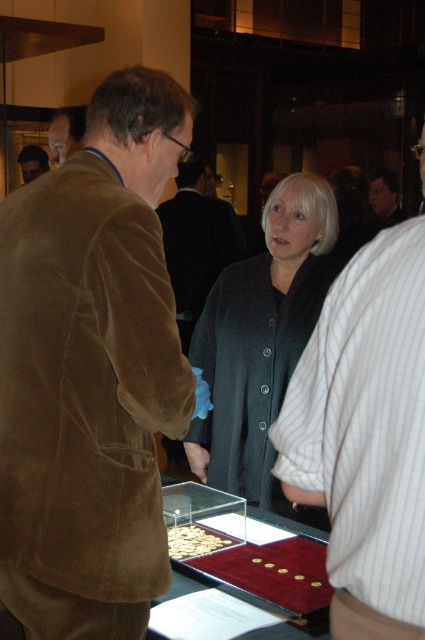
You are a security guard in the museum. You need to ensure that the shiny gold coins at center are visible to all visitors. Currently, the man in the brown corduroy jacket and the person in the striped shirt are standing between the coins and the entrance. How far apart should you position these two individuals to maintain visibility?

To ensure visibility of the shiny gold coins at center, the man in the brown corduroy jacket and the person in the striped shirt should be positioned 4.44 feet apart.

You are standing in a museum and see the white striped shirt at right and the matte brown jacket at upper left. Which one is closer to the display case containing coins?

The white striped shirt at right is to the right of the matte brown jacket at upper left, so the white striped shirt at right is closer to the display case containing coins.

Based on the photo, you are a security guard in the museum and need to ensure that the shiny gold coins at center are visible to visitors. Given that the matte brown jacket at upper left is blocking part of the display, is the height of the coins sufficient to be seen over the jacket?

→ The shiny gold coins at center has a lesser height compared to matte brown jacket at upper left, so they might be partially obscured. The coins are shorter than the jacket, making them harder to see over it.